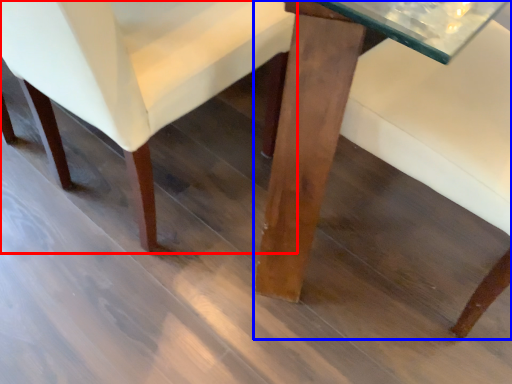
Question: Which object is closer to the camera taking this photo, chair (highlighted by a red box) or table (highlighted by a blue box)?

Choices:
 (A) chair
 (B) table

Answer: (B)